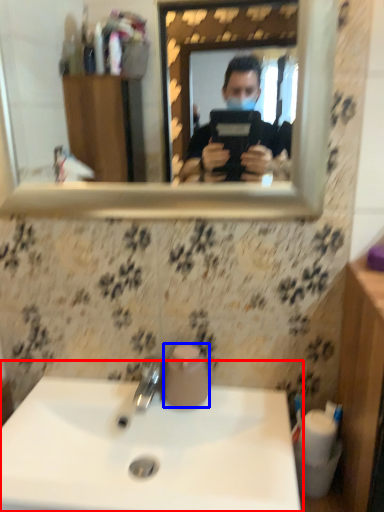
Question: Among these objects, which one is nearest to the camera, sink (highlighted by a red box) or toilet paper (highlighted by a blue box)?

Choices:
 (A) sink
 (B) toilet paper

Answer: (A)